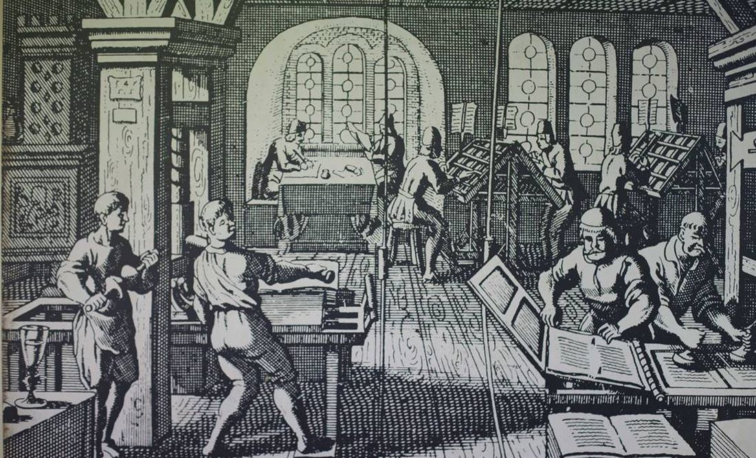
What are the coordinates of `columns` in the screenshot? It's located at (156, 152), (194, 145).